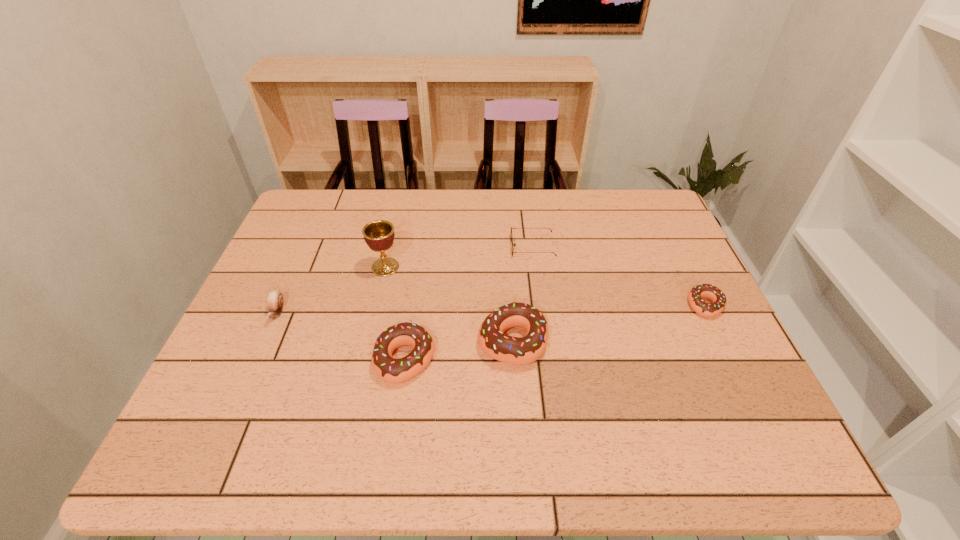
The width and height of the screenshot is (960, 540). In order to click on free location that satisfies the following two spatial constraints: 1. on the front-facing side of the third shortest object; 2. on the left side of the leftmost doughnut in this screenshot , I will do `click(256, 360)`.